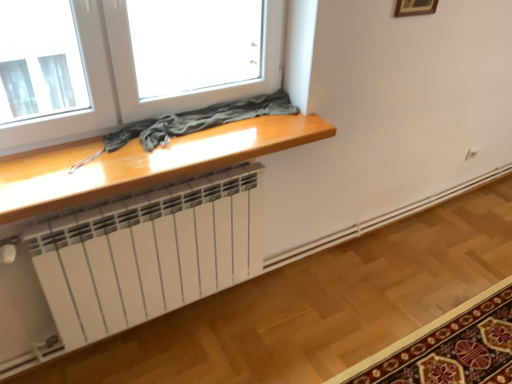
Question: Could you tell me if wooden picture frame at upper right is facing carpet with floral pattern at lower right?

Choices:
 (A) yes
 (B) no

Answer: (B)

Question: Does wooden picture frame at upper right have a smaller size compared to carpet with floral pattern at lower right?

Choices:
 (A) yes
 (B) no

Answer: (A)

Question: Is carpet with floral pattern at lower right located within wooden picture frame at upper right?

Choices:
 (A) no
 (B) yes

Answer: (A)

Question: Can you confirm if wooden picture frame at upper right is shorter than carpet with floral pattern at lower right?

Choices:
 (A) no
 (B) yes

Answer: (A)

Question: Does wooden picture frame at upper right have a larger size compared to carpet with floral pattern at lower right?

Choices:
 (A) no
 (B) yes

Answer: (A)

Question: Is wooden picture frame at upper right far from carpet with floral pattern at lower right?

Choices:
 (A) yes
 (B) no

Answer: (A)

Question: Does carpet with floral pattern at lower right have a greater height compared to glossy wood table at upper center?

Choices:
 (A) yes
 (B) no

Answer: (A)

Question: Would you say carpet with floral pattern at lower right is outside glossy wood table at upper center?

Choices:
 (A) no
 (B) yes

Answer: (B)

Question: From the image's perspective, is carpet with floral pattern at lower right under glossy wood table at upper center?

Choices:
 (A) no
 (B) yes

Answer: (B)

Question: Are carpet with floral pattern at lower right and glossy wood table at upper center beside each other?

Choices:
 (A) no
 (B) yes

Answer: (A)

Question: Would you say carpet with floral pattern at lower right contains glossy wood table at upper center?

Choices:
 (A) yes
 (B) no

Answer: (B)

Question: Is carpet with floral pattern at lower right closer to camera compared to glossy wood table at upper center?

Choices:
 (A) no
 (B) yes

Answer: (A)

Question: Are glossy wood table at upper center and wooden picture frame at upper right located far from each other?

Choices:
 (A) no
 (B) yes

Answer: (B)